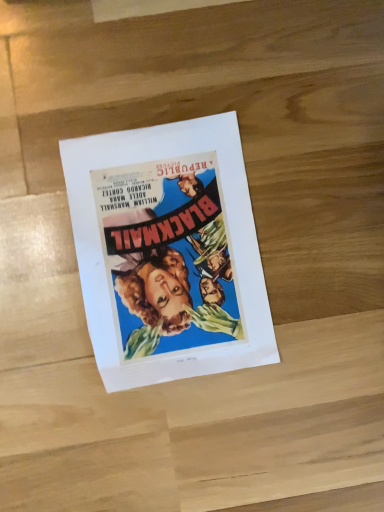
Where is `matte paper poster at center`? The height and width of the screenshot is (512, 384). matte paper poster at center is located at coordinates (168, 252).

Describe the element at coordinates (168, 252) in the screenshot. This screenshot has width=384, height=512. I see `matte paper poster at center` at that location.

In order to click on matte paper poster at center in this screenshot , I will do `click(168, 252)`.